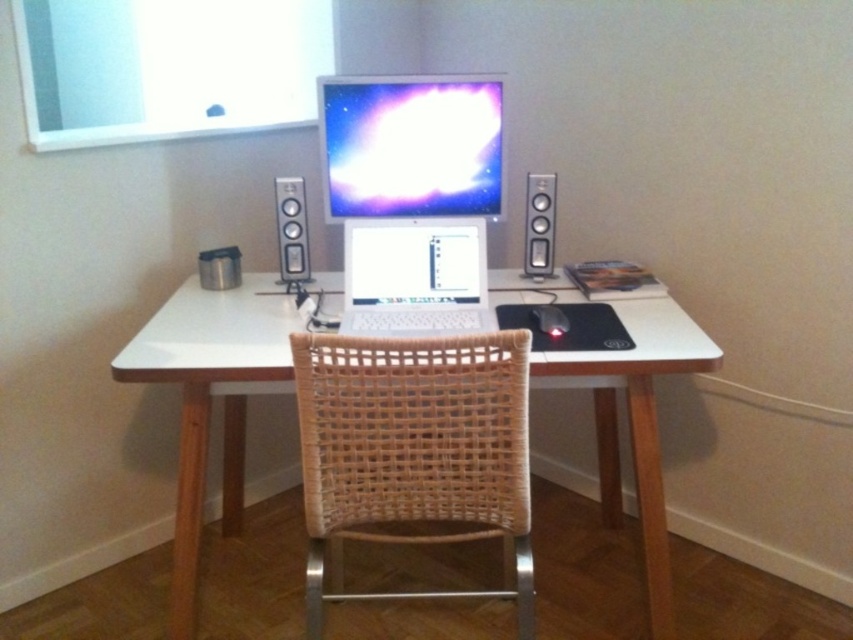
Between matte plastic monitor at center and black matte mouse at center, which one appears on the left side from the viewer's perspective?

Positioned to the left is matte plastic monitor at center.

Who is taller, matte plastic monitor at center or black matte mouse at center?

matte plastic monitor at center

You are a GUI agent. You are given a task and a screenshot of the screen. Output one action in this format:
    pyautogui.click(x=<x>, y=<y>)
    Task: Click on the matte plastic monitor at center
    
    Given the screenshot: What is the action you would take?
    pyautogui.click(x=410, y=145)

Is woven wood swivel chair at center to the right of silver metallic speaker at center from the viewer's perspective?

Yes, woven wood swivel chair at center is to the right of silver metallic speaker at center.

From the picture: Can you confirm if woven wood swivel chair at center is taller than silver metallic speaker at center?

Correct, woven wood swivel chair at center is much taller as silver metallic speaker at center.

The width and height of the screenshot is (853, 640). What are the coordinates of `woven wood swivel chair at center` in the screenshot? It's located at (415, 449).

Which is behind, point (386, 152) or point (543, 216)?

The point (543, 216) is more distant.

Who is shorter, matte plastic monitor at center or satin silver speaker at right?

Standing shorter between the two is satin silver speaker at right.

This screenshot has width=853, height=640. In order to click on matte plastic monitor at center in this screenshot , I will do `click(410, 145)`.

Locate an element on the screen. matte plastic monitor at center is located at coordinates (410, 145).